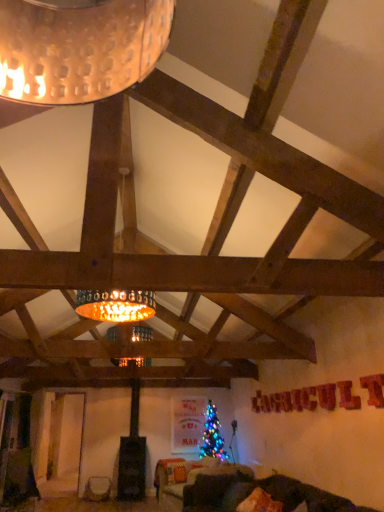
Question: Considering the relative sizes of velvet dark green couch at lower center and velvet orange pillow at lower center in the image provided, is velvet dark green couch at lower center taller than velvet orange pillow at lower center?

Choices:
 (A) no
 (B) yes

Answer: (B)

Question: From a real-world perspective, is velvet dark green couch at lower center under velvet orange pillow at lower center?

Choices:
 (A) no
 (B) yes

Answer: (B)

Question: Does velvet dark green couch at lower center have a larger size compared to velvet orange pillow at lower center?

Choices:
 (A) yes
 (B) no

Answer: (A)

Question: Does velvet dark green couch at lower center turn towards velvet orange pillow at lower center?

Choices:
 (A) yes
 (B) no

Answer: (A)

Question: Considering the relative sizes of velvet dark green couch at lower center and velvet orange pillow at lower center in the image provided, is velvet dark green couch at lower center thinner than velvet orange pillow at lower center?

Choices:
 (A) no
 (B) yes

Answer: (A)

Question: Is velvet dark green couch at lower center turned away from velvet orange pillow at lower center?

Choices:
 (A) no
 (B) yes

Answer: (B)

Question: Is matte white vase at lower left facing away from velvet dark green couch at lower center?

Choices:
 (A) yes
 (B) no

Answer: (B)

Question: Considering the relative sizes of matte white vase at lower left and velvet dark green couch at lower center in the image provided, is matte white vase at lower left taller than velvet dark green couch at lower center?

Choices:
 (A) yes
 (B) no

Answer: (B)

Question: From a real-world perspective, is matte white vase at lower left positioned over velvet dark green couch at lower center based on gravity?

Choices:
 (A) yes
 (B) no

Answer: (B)

Question: Would you say velvet dark green couch at lower center is part of matte white vase at lower left's contents?

Choices:
 (A) yes
 (B) no

Answer: (B)

Question: Is matte white vase at lower left positioned beyond the bounds of velvet dark green couch at lower center?

Choices:
 (A) yes
 (B) no

Answer: (A)

Question: Does matte white vase at lower left have a lesser width compared to velvet dark green couch at lower center?

Choices:
 (A) yes
 (B) no

Answer: (A)

Question: From the image's perspective, would you say velvet dark green couch at lower center is shown under matte white vase at lower left?

Choices:
 (A) yes
 (B) no

Answer: (B)